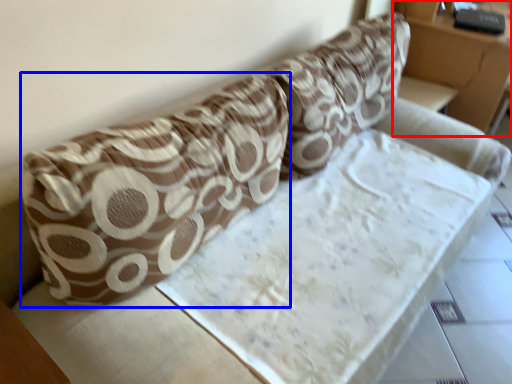
Question: Among these objects, which one is farthest to the camera, furniture (highlighted by a red box) or throw pillow (highlighted by a blue box)?

Choices:
 (A) furniture
 (B) throw pillow

Answer: (A)